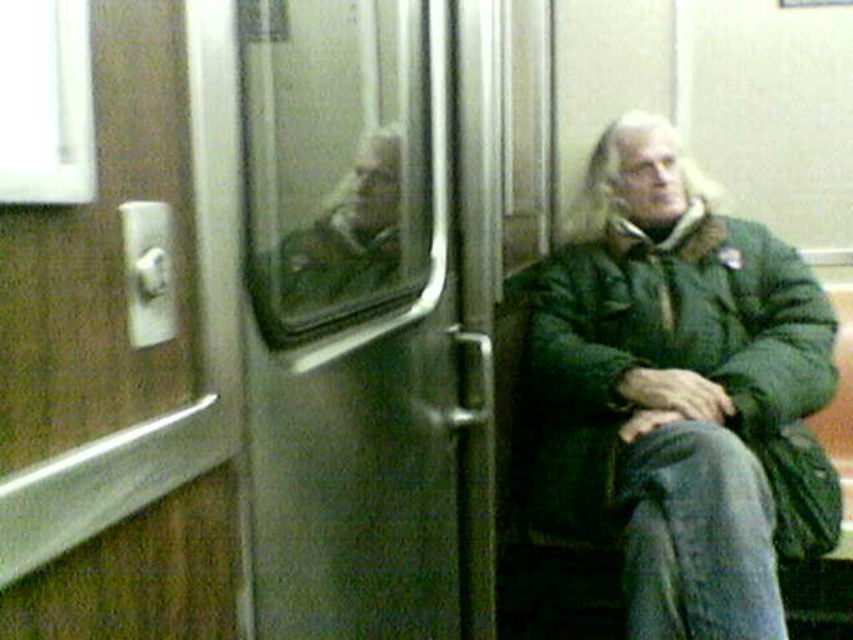
Between point (596, 497) and point (352, 253), which one is positioned in front?

Point (352, 253) is in front.

I want to click on green fuzzy jacket at right, so click(x=677, y=364).